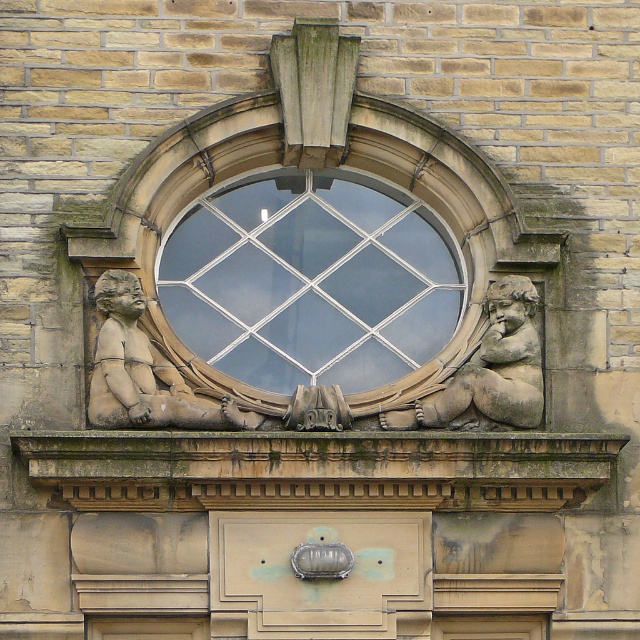
Question: Is matte stone cherub at lower left smaller than stone cherub at center?

Choices:
 (A) yes
 (B) no

Answer: (A)

Question: Which of these objects is positioned farthest from the matte bronze ornament at center?

Choices:
 (A) matte stone cherub at lower left
 (B) stone cherub at center

Answer: (A)

Question: Among these points, which one is farthest from the camera?

Choices:
 (A) (317, 417)
 (B) (259, 196)
 (C) (93, 378)

Answer: (B)

Question: Which is farther from the stone cherub at center?

Choices:
 (A) clear glass window at center
 (B) matte bronze ornament at center

Answer: (A)

Question: Is clear glass window at center positioned before stone cherub at center?

Choices:
 (A) no
 (B) yes

Answer: (A)

Question: Can you confirm if matte stone cherub at lower left is positioned to the left of stone cherub at center?

Choices:
 (A) no
 (B) yes

Answer: (B)